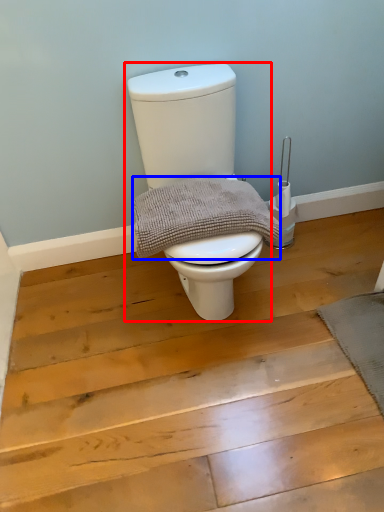
Question: Which object appears closest to the camera in this image, toilet (highlighted by a red box) or material (highlighted by a blue box)?

Choices:
 (A) toilet
 (B) material

Answer: (A)